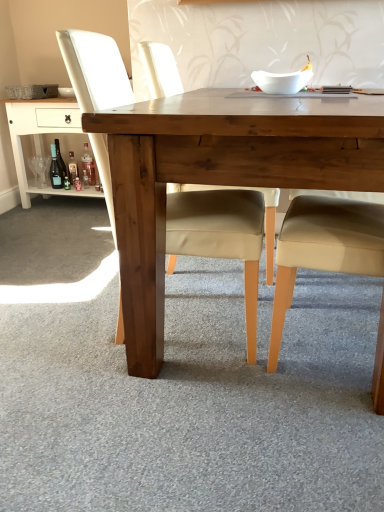
Question: Is wooden table at center taller or shorter than matte beige chair at center?

Choices:
 (A) tall
 (B) short

Answer: (B)

Question: In the image, is wooden table at center positioned in front of or behind matte beige chair at center?

Choices:
 (A) behind
 (B) front

Answer: (B)

Question: Which object is positioned closest to the matte beige chair at center?

Choices:
 (A) wooden table at lower left
 (B) matte glass bottle at lower left, the 1th bottle viewed from the left
 (C) translucent glass bottle at lower left, which appears as the 2th bottle when viewed from the left
 (D) wooden table at center
 (E) translucent plastic bottle at lower left, the first bottle viewed from the right

Answer: (D)

Question: Estimate the real-world distances between objects in this image. Which object is farther from the translucent plastic bottle at lower left, arranged as the third bottle when viewed from the left?

Choices:
 (A) white glossy bowl at upper center
 (B) wooden table at center
 (C) matte beige chair at center
 (D) matte glass bottle at lower left, the 1th bottle viewed from the left
 (E) wooden table at lower left

Answer: (B)